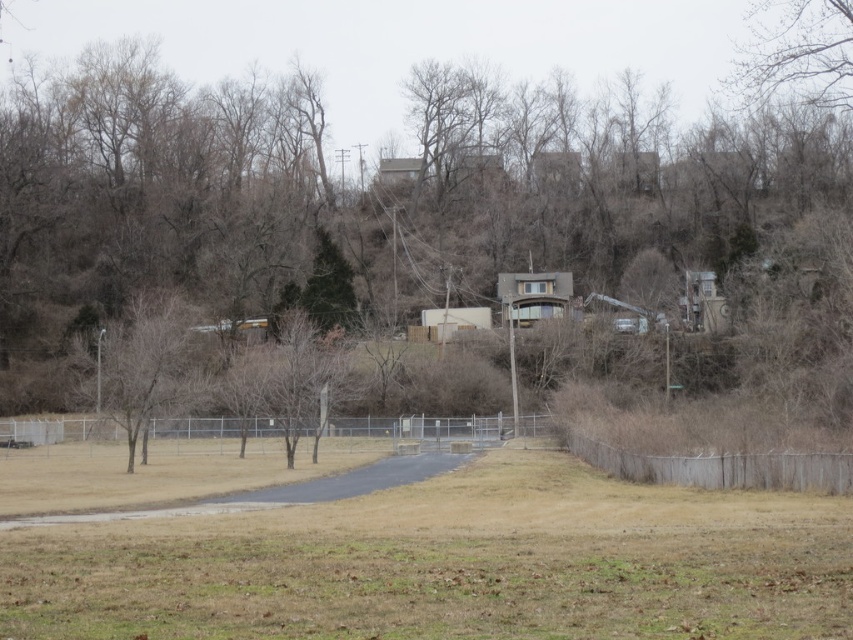
Question: Can you confirm if brown textured tree at center is bigger than brown leafless tree at left?

Choices:
 (A) no
 (B) yes

Answer: (B)

Question: Estimate the real-world distances between objects in this image. Which object is farther from the brown textured tree at center?

Choices:
 (A) brown dry grass at lower center
 (B) brown leafless tree at left

Answer: (A)

Question: Does brown textured tree at center come in front of brown leafless tree at left?

Choices:
 (A) no
 (B) yes

Answer: (B)

Question: Which point is closer to the camera?

Choices:
 (A) (837, 68)
 (B) (45, 548)
 (C) (131, 429)

Answer: (B)

Question: Estimate the real-world distances between objects in this image. Which object is closer to the brown dry grass at lower center?

Choices:
 (A) brown leafless tree at left
 (B) brown textured tree at center

Answer: (A)

Question: Is brown textured tree at center to the left of brown dry grass at lower center from the viewer's perspective?

Choices:
 (A) no
 (B) yes

Answer: (B)